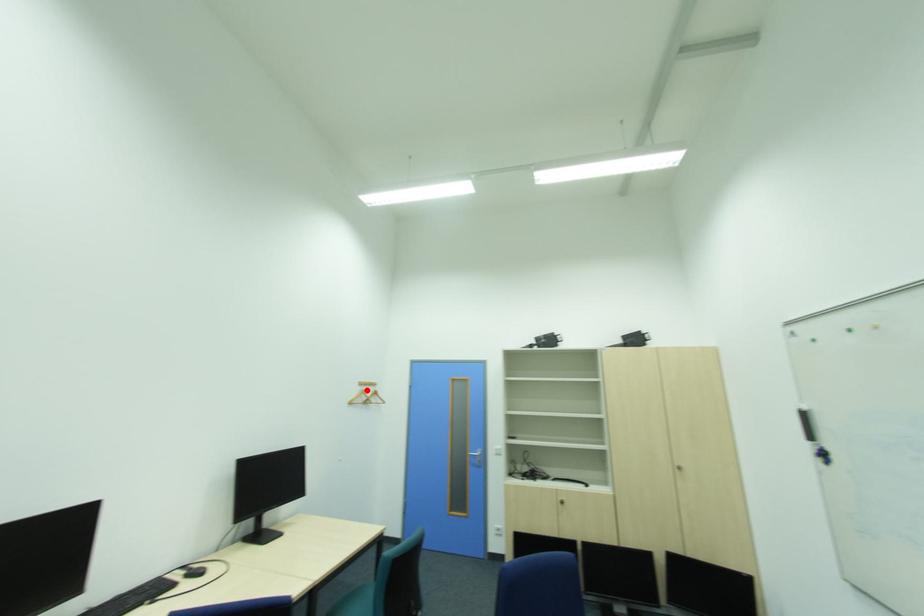
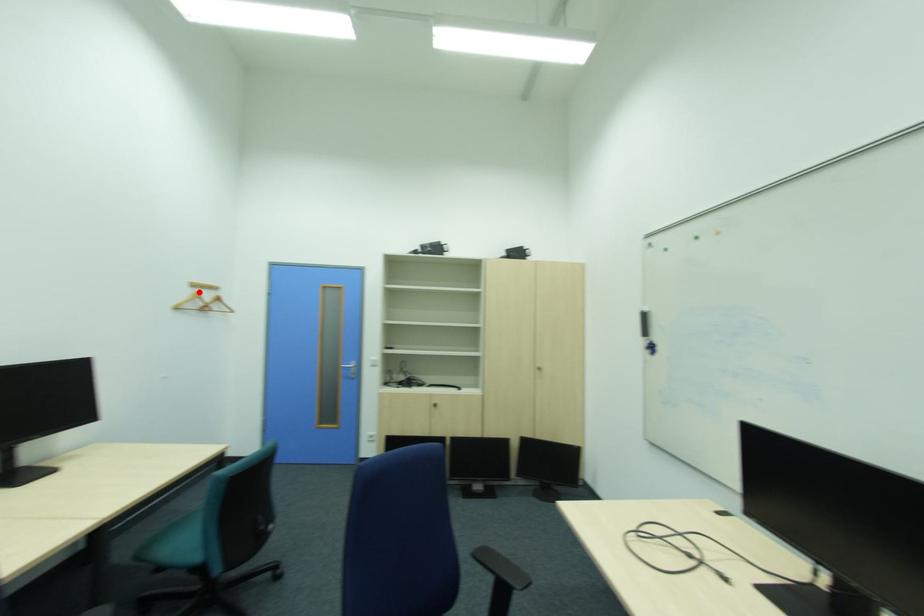
I am providing you with two images of the same scene from different viewpoints. A red point is marked on the first image and another point is marked on the second image. Do the highlighted points in image1 and image2 indicate the same real-world spot?

Yes